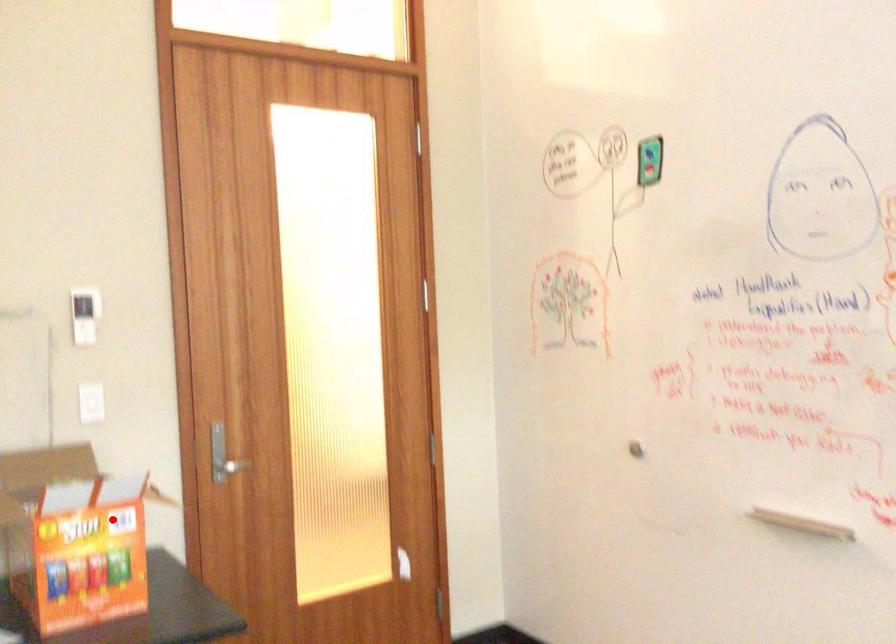
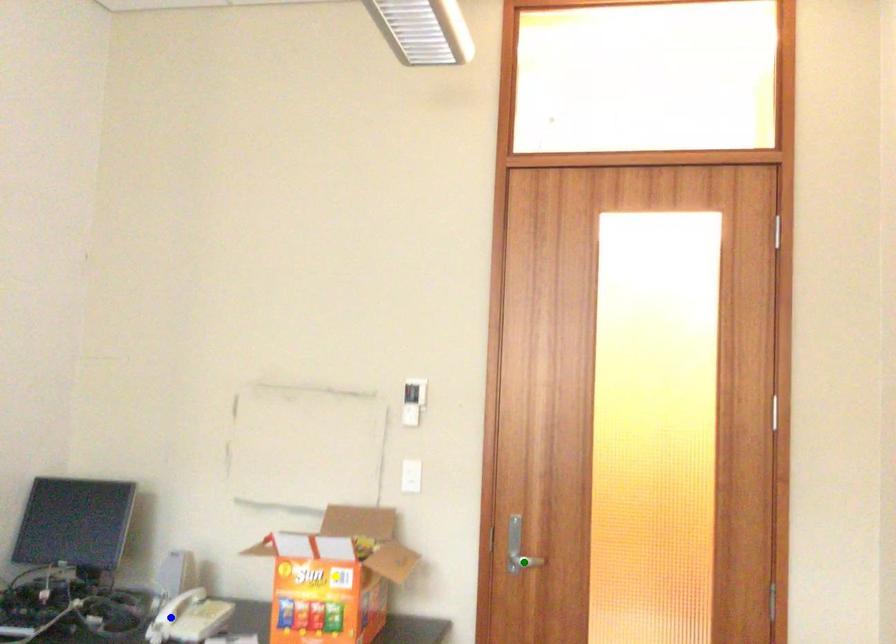
Question: I am providing you with two images of the same scene from different viewpoints. A red point is marked on the first image. You are given multiple points on the second image. Can you choose the point in image 2 that corresponds to the point in image 1?

Choices:
 (A) yellow point
 (B) blue point
 (C) green point

Answer: (A)